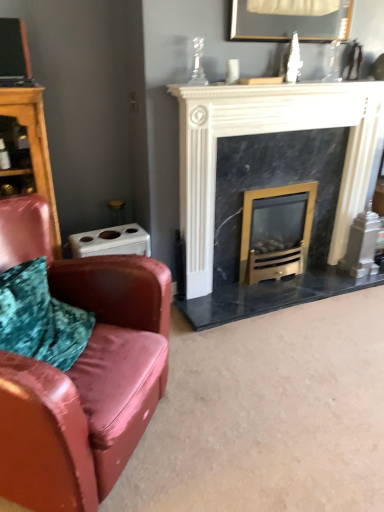
Question: Is gold metallic wood burning stove at center smaller than wooden dresser at left?

Choices:
 (A) no
 (B) yes

Answer: (B)

Question: Considering the relative positions of gold metallic wood burning stove at center and wooden dresser at left in the image provided, is gold metallic wood burning stove at center to the left of wooden dresser at left from the viewer's perspective?

Choices:
 (A) yes
 (B) no

Answer: (B)

Question: Is gold metallic wood burning stove at center further to camera compared to wooden dresser at left?

Choices:
 (A) yes
 (B) no

Answer: (A)

Question: Can you confirm if gold metallic wood burning stove at center is shorter than wooden dresser at left?

Choices:
 (A) yes
 (B) no

Answer: (A)

Question: Considering the relative sizes of gold metallic wood burning stove at center and wooden dresser at left in the image provided, is gold metallic wood burning stove at center thinner than wooden dresser at left?

Choices:
 (A) yes
 (B) no

Answer: (A)

Question: Does gold metallic wood burning stove at center have a larger size compared to wooden dresser at left?

Choices:
 (A) yes
 (B) no

Answer: (B)

Question: Considering the relative sizes of leather couch at left and gold metallic wood burning stove at center in the image provided, is leather couch at left thinner than gold metallic wood burning stove at center?

Choices:
 (A) yes
 (B) no

Answer: (B)

Question: From a real-world perspective, is leather couch at left located beneath gold metallic wood burning stove at center?

Choices:
 (A) no
 (B) yes

Answer: (A)

Question: From the image's perspective, is leather couch at left beneath gold metallic wood burning stove at center?

Choices:
 (A) yes
 (B) no

Answer: (A)

Question: Is leather couch at left outside of gold metallic wood burning stove at center?

Choices:
 (A) no
 (B) yes

Answer: (B)

Question: Is leather couch at left further to camera compared to gold metallic wood burning stove at center?

Choices:
 (A) no
 (B) yes

Answer: (A)

Question: Can you see leather couch at left touching gold metallic wood burning stove at center?

Choices:
 (A) yes
 (B) no

Answer: (B)

Question: Considering the relative positions of black marble fireplace at center and gold metallic wood burning stove at center in the image provided, is black marble fireplace at center to the right of gold metallic wood burning stove at center from the viewer's perspective?

Choices:
 (A) yes
 (B) no

Answer: (A)